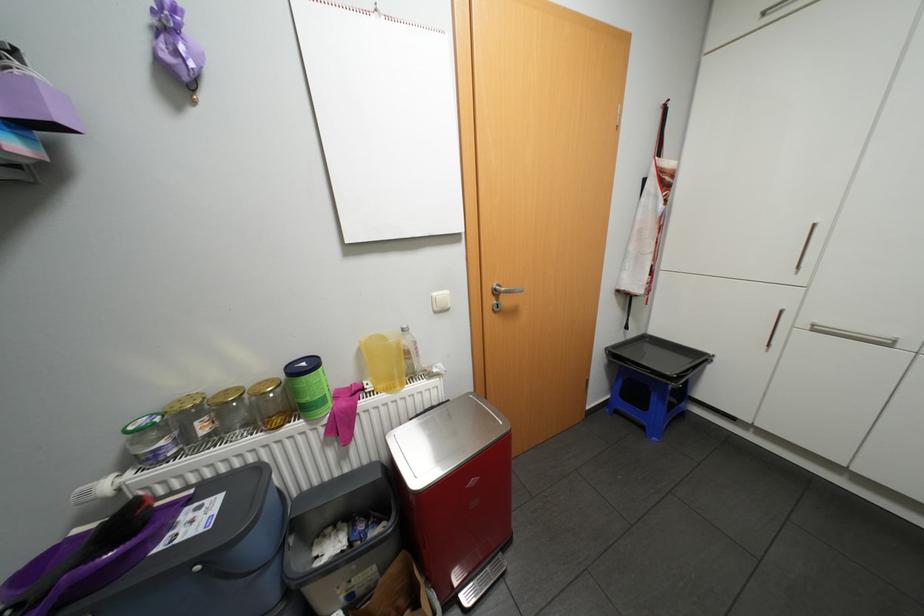
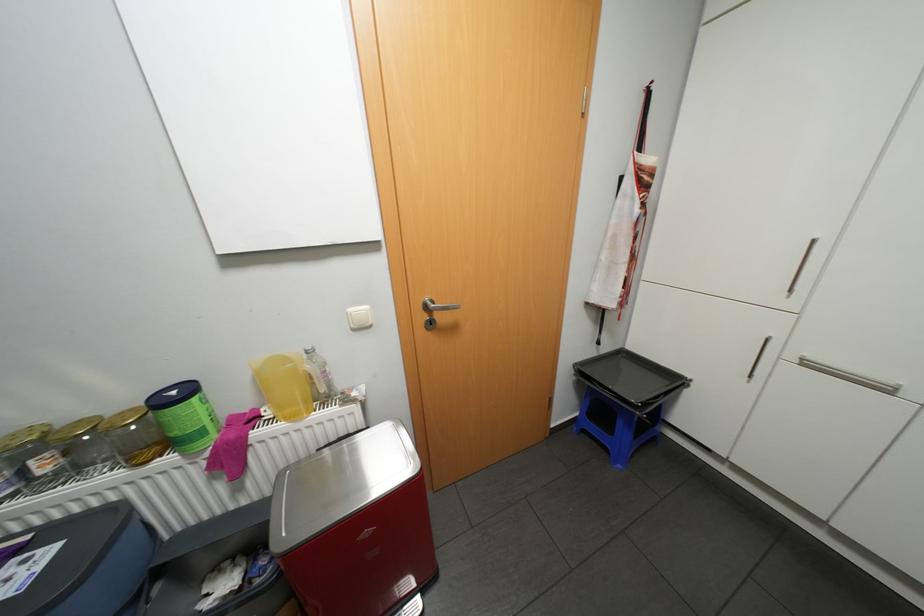
In the second image, find the point that corresponds to point 235,389 in the first image.

(88, 419)